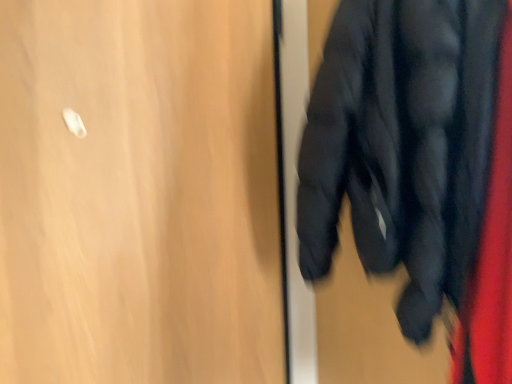
Question: From a real-world perspective, relative to matte black jacket at right, is wooden door at upper left vertically above or below?

Choices:
 (A) below
 (B) above

Answer: (A)

Question: Relative to matte black jacket at right, is wooden door at upper left in front or behind?

Choices:
 (A) front
 (B) behind

Answer: (B)

Question: Looking at the image, does wooden door at upper left seem bigger or smaller compared to matte black jacket at right?

Choices:
 (A) big
 (B) small

Answer: (B)

Question: From their relative heights in the image, would you say matte black jacket at right is taller or shorter than wooden door at upper left?

Choices:
 (A) tall
 (B) short

Answer: (B)

Question: Considering their positions, is matte black jacket at right located in front of or behind wooden door at upper left?

Choices:
 (A) front
 (B) behind

Answer: (A)

Question: Is point (433, 165) positioned closer to the camera than point (166, 152)?

Choices:
 (A) closer
 (B) farther

Answer: (A)

Question: From a real-world perspective, is matte black jacket at right physically located above or below wooden door at upper left?

Choices:
 (A) below
 (B) above

Answer: (B)